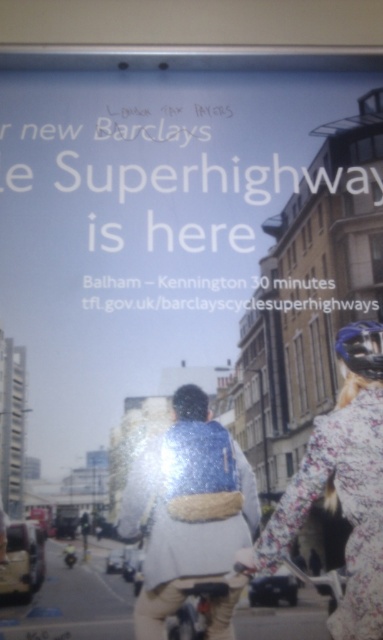
You are a photographer trying to capture both the shiny blue jacket at center and the floral fabric jacket at center in a single frame. Which jacket would you need to position closer to the camera to ensure both fit within the frame, considering their sizes?

The shiny blue jacket at center is narrower than the floral fabric jacket at center. To fit both in the frame, position the wider floral fabric jacket at center closer to the camera so its larger size fills the frame appropriately while the narrower shiny blue jacket at center can be placed slightly farther back, maintaining visibility without overcrowding.

You are a pedestrian standing in front of the Barclays Superhighway advertisement. You notice two jackets in the center of the image. Which jacket is closer to you, the shiny blue jacket at center or the floral fabric jacket at center?

The shiny blue jacket at center is closer to you because the floral fabric jacket at center is positioned behind it.